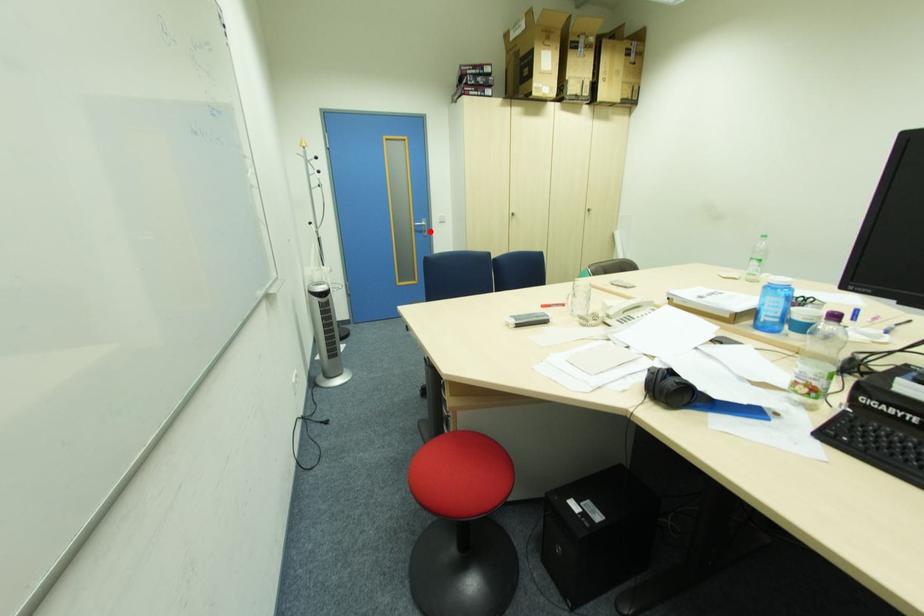
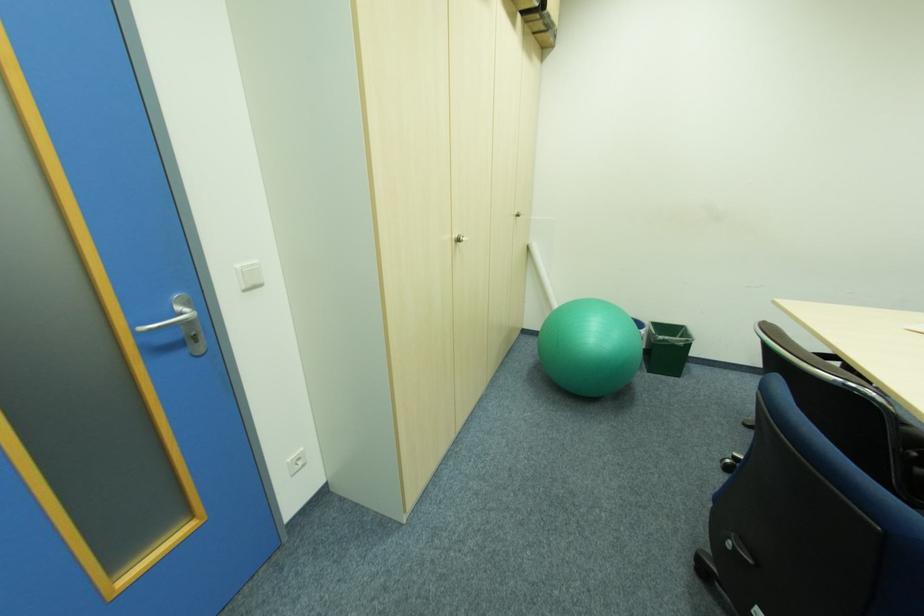
The point at the highlighted location is marked in the first image. Where is the corresponding point in the second image?

(200, 339)